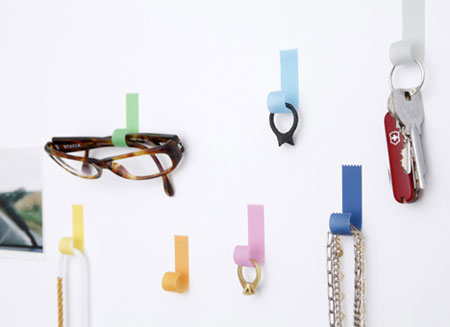
In order to click on pictre on wall in this screenshot , I will do `click(17, 217)`.